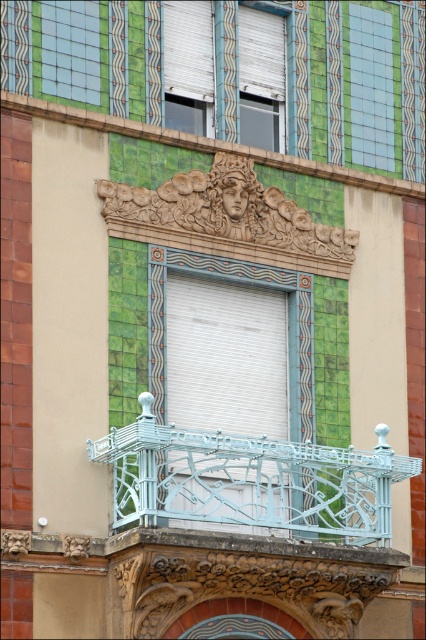
In the scene shown: Between white matte window at center and green tile at upper right, which one has less height?

green tile at upper right

Can you confirm if white matte window at center is positioned below green tile at upper right?

Yes.

Where is `white matte window at center`? The width and height of the screenshot is (426, 640). white matte window at center is located at coordinates (244, 284).

Between point (370, 506) and point (382, 144), which one is positioned behind?

Point (382, 144)

Between light blue wrought iron at center and green tile at upper right, which one appears on the right side from the viewer's perspective?

Positioned to the right is green tile at upper right.

Does point (302, 464) come closer to viewer compared to point (383, 109)?

Yes, it is in front of point (383, 109).

Locate an element on the screen. The image size is (426, 640). light blue wrought iron at center is located at coordinates (250, 481).

Does light blue wrought iron at center have a greater height compared to golden textured sculpture at upper center?

Indeed, light blue wrought iron at center has a greater height compared to golden textured sculpture at upper center.

Is light blue wrought iron at center further to the viewer compared to golden textured sculpture at upper center?

No, it is in front of golden textured sculpture at upper center.

Does point (138, 520) lie in front of point (106, 221)?

Yes, it is in front of point (106, 221).

Find the location of a particular element. Image resolution: width=426 pixels, height=640 pixels. light blue wrought iron at center is located at coordinates (250, 481).